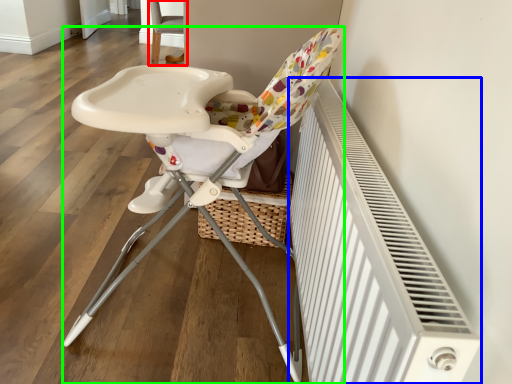
Question: Considering the real-world distances, which object is farthest from chair (highlighted by a red box)? radiator (highlighted by a blue box) or chair (highlighted by a green box)?

Choices:
 (A) radiator
 (B) chair

Answer: (A)